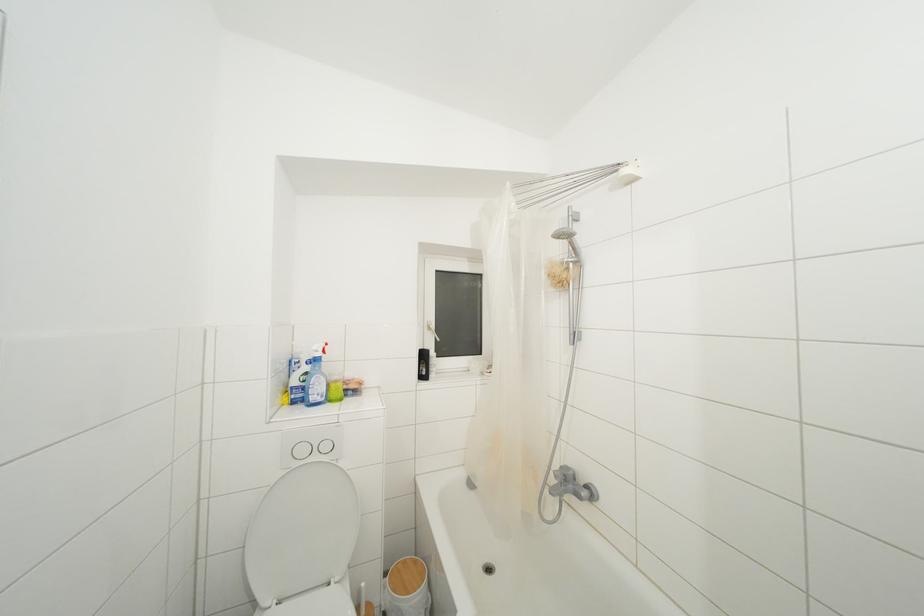
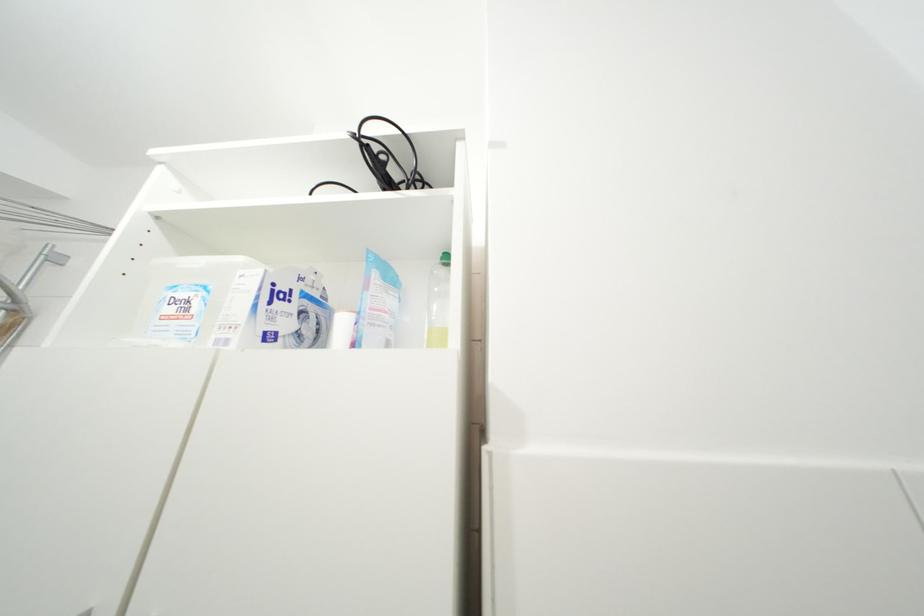
The images are taken continuously from a first-person perspective. In which direction is your viewpoint rotating?

The camera's rotation is toward right-up.